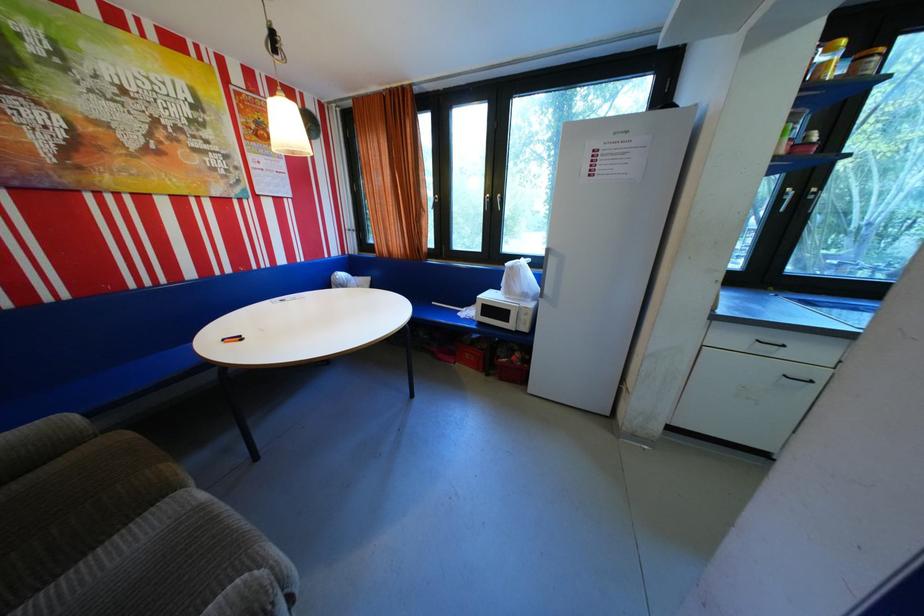
This screenshot has width=924, height=616. What do you see at coordinates (129, 541) in the screenshot?
I see `a brown sofa sitting surface` at bounding box center [129, 541].